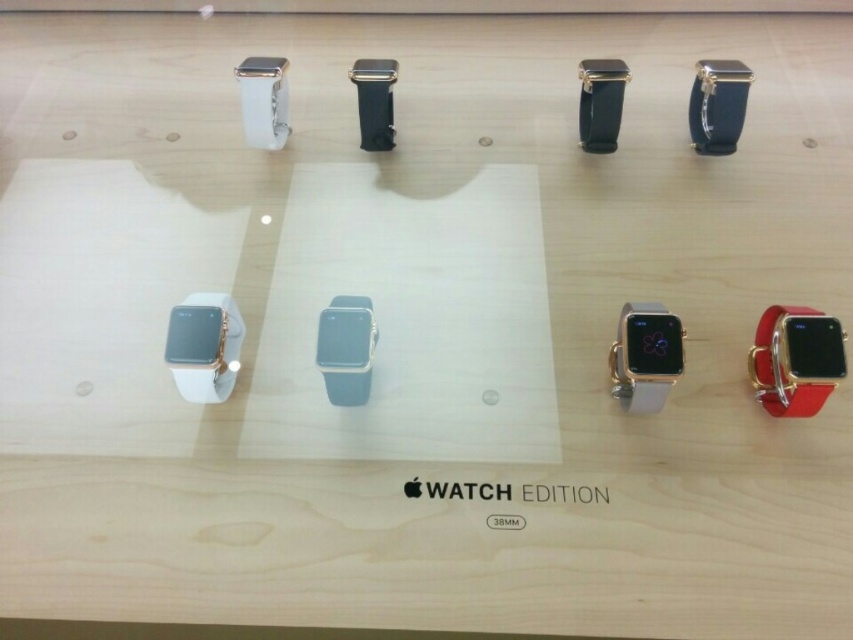
Question: Which of the following is the closest to the observer?

Choices:
 (A) (750, 358)
 (B) (289, 131)

Answer: (A)

Question: Is gold metallic watch at center-right below satin silver watch at center?

Choices:
 (A) yes
 (B) no

Answer: (A)

Question: Is gold metallic watch at center-right above satin silver watch at center?

Choices:
 (A) no
 (B) yes

Answer: (A)

Question: Is matte red leather watch at right to the right of satin black watch at upper right from the viewer's perspective?

Choices:
 (A) no
 (B) yes

Answer: (B)

Question: Which point is closer to the camera?

Choices:
 (A) satin black watch at upper right
 (B) gold metallic watch at center-right
 (C) white matte apple watch at lower left
 (D) satin silver watch at center

Answer: (B)

Question: Which of the following is the closest to the observer?

Choices:
 (A) satin black watch at upper right
 (B) black leather watch at center
 (C) white matte watch at upper left
 (D) matte red leather watch at right

Answer: (D)